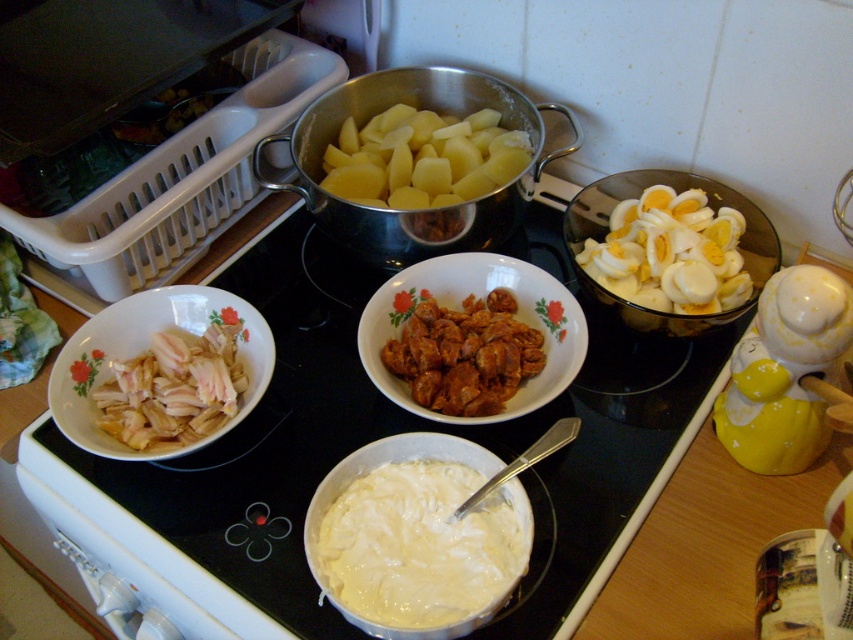
Can you confirm if white glossy bowl at lower right is positioned below brown crispy chicken at center?

Yes, white glossy bowl at lower right is below brown crispy chicken at center.

Does white glossy bowl at lower right appear on the left side of brown crispy chicken at center?

No, white glossy bowl at lower right is not to the left of brown crispy chicken at center.

You are a GUI agent. You are given a task and a screenshot of the screen. Output one action in this format:
    pyautogui.click(x=<x>, y=<y>)
    Task: Click on the white glossy bowl at lower right
    
    Given the screenshot: What is the action you would take?
    pyautogui.click(x=784, y=371)

Can you confirm if white creamy sauce at center is smaller than white glossy bowl at lower right?

Correct, white creamy sauce at center occupies less space than white glossy bowl at lower right.

Which is behind, point (514, 483) or point (801, 323)?

The point (514, 483) is behind.

Is point (354, 588) more distant than point (782, 410)?

No, (354, 588) is in front of (782, 410).

The image size is (853, 640). I want to click on white creamy sauce at center, so click(x=419, y=547).

Is point (720, 394) positioned in front of point (694, 236)?

Yes, point (720, 394) is closer to viewer.

Which is behind, point (732, 390) or point (676, 307)?

The point (676, 307) is behind.

You are a GUI agent. You are given a task and a screenshot of the screen. Output one action in this format:
    pyautogui.click(x=<x>, y=<y>)
    Task: Click on the white glossy bowl at lower right
    The image size is (853, 640).
    Given the screenshot: What is the action you would take?
    pyautogui.click(x=784, y=371)